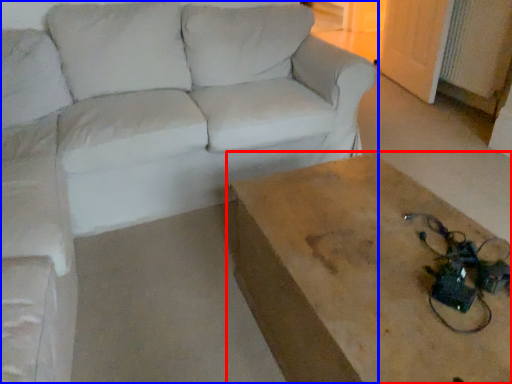
Question: Which object appears closest to the camera in this image, table (highlighted by a red box) or studio couch (highlighted by a blue box)?

Choices:
 (A) table
 (B) studio couch

Answer: (A)